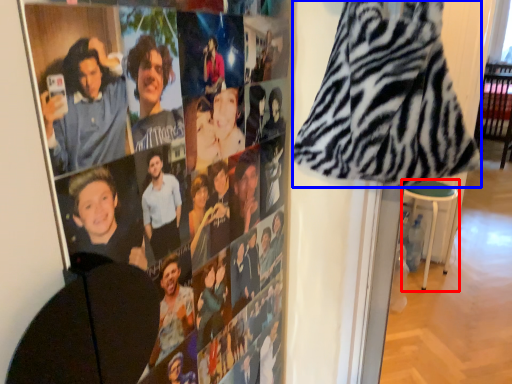
Question: Which object is further to the camera taking this photo, bar stool (highlighted by a red box) or blanket (highlighted by a blue box)?

Choices:
 (A) bar stool
 (B) blanket

Answer: (A)